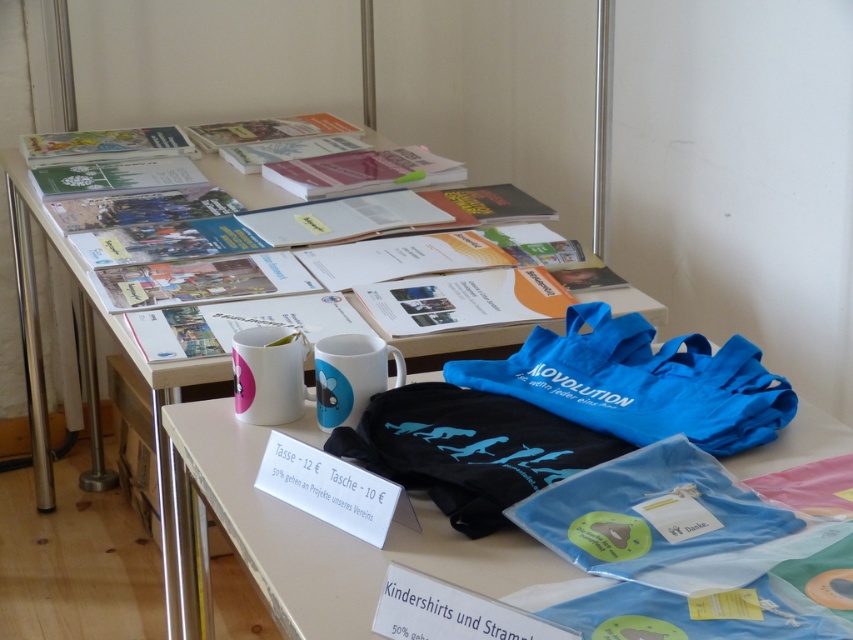
You are setting up a booth at an event and need to stack items vertically. You have a blue fabric bag at lower right and a white glossy mug at upper center. Which item should you place at the bottom of the stack to ensure stability?

The blue fabric bag at lower right should be placed at the bottom of the stack because it has a greater height compared to the white glossy mug at upper center, providing a more stable base.

You are a customer at the fair and want to place the matte paper magazine at upper center on top of the blue fabric bag at lower right. Can you do this without moving any other items?

The distance between the blue fabric bag at lower right and the matte paper magazine at upper center is 16.82 inches, so you can place the matte paper magazine at upper center on top of the blue fabric bag at lower right without moving other items if there is enough space. However, the exact feasibility depends on the size of the magazine and the bag, which are not specified here.